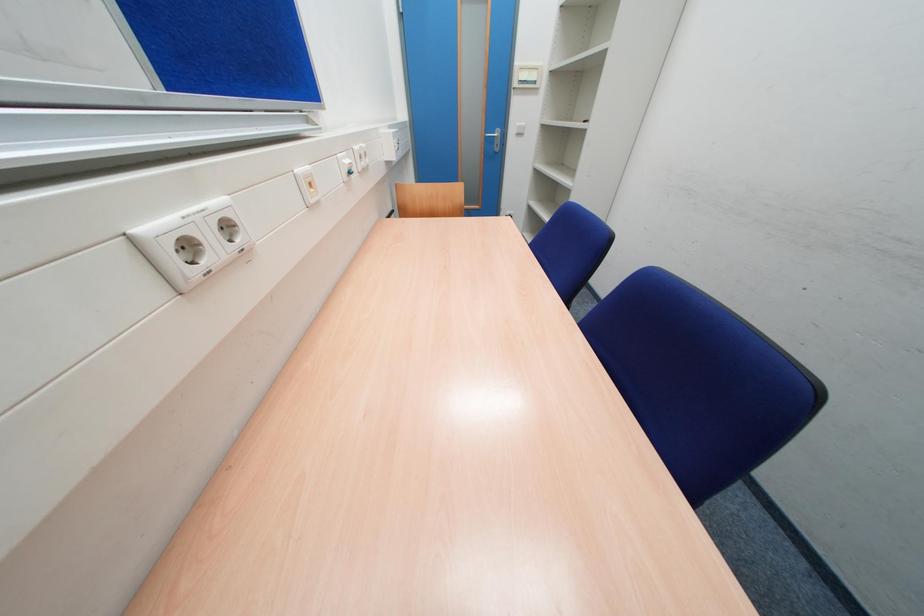
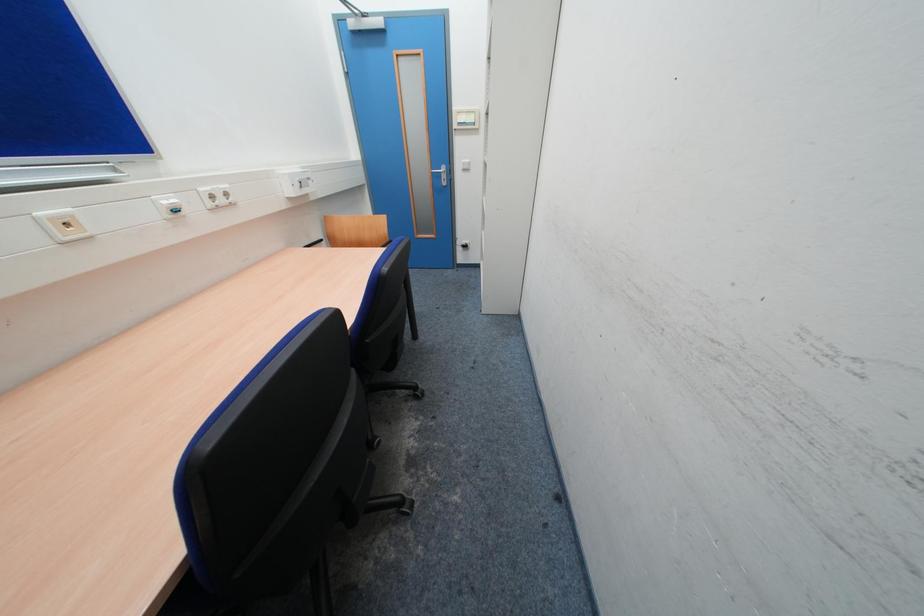
Question: The images are taken continuously from a first-person perspective. In which direction is your viewpoint rotating?

Choices:
 (A) Left
 (B) Right
 (C) Up
 (D) Down

Answer: (A)